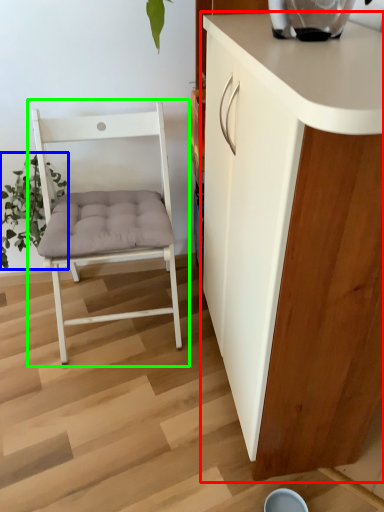
Question: Which object is positioned closest to cabinetry (highlighted by a red box)? Select from plant (highlighted by a blue box) and chair (highlighted by a green box).

Choices:
 (A) plant
 (B) chair

Answer: (B)